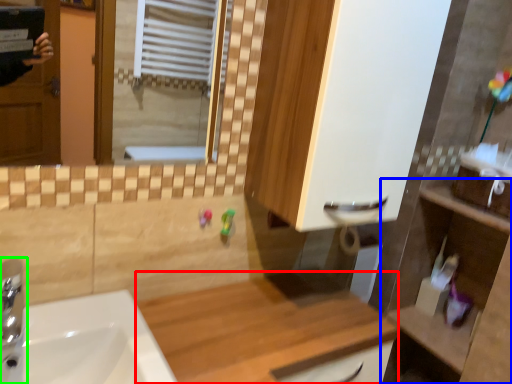
Question: Which object is positioned closest to counter top (highlighted by a red box)? Select from counter (highlighted by a blue box) and tap (highlighted by a green box).

Choices:
 (A) counter
 (B) tap

Answer: (A)